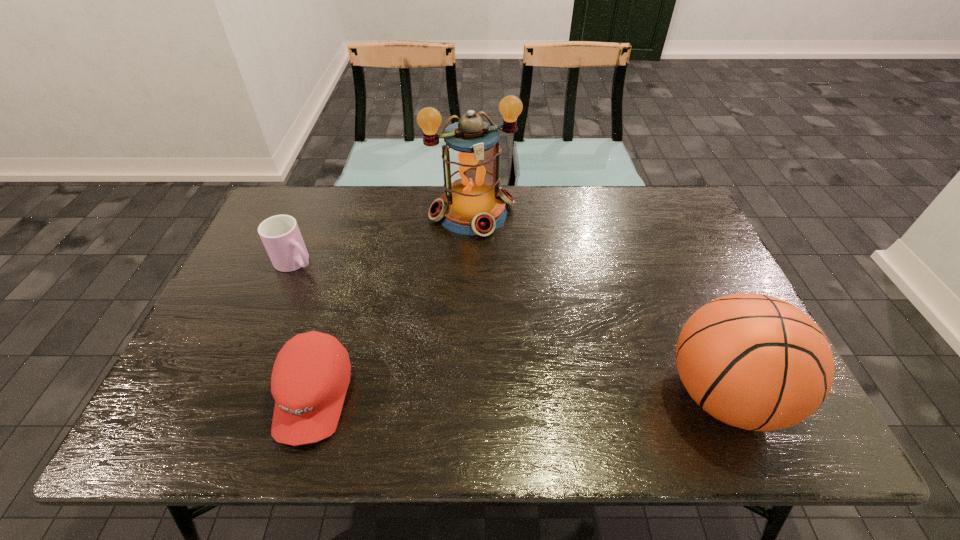
Find the location of a particular element. The image size is (960, 540). free space at the far edge of the desktop is located at coordinates (x=368, y=205).

This screenshot has width=960, height=540. I want to click on free space at the near edge of the desktop, so click(x=632, y=370).

The width and height of the screenshot is (960, 540). What are the coordinates of `vacant space at the left edge of the desktop` in the screenshot? It's located at (263, 259).

You are a GUI agent. You are given a task and a screenshot of the screen. Output one action in this format:
    pyautogui.click(x=<x>, y=<y>)
    Task: Click on the vacant space at the right edge
    
    Given the screenshot: What is the action you would take?
    pyautogui.click(x=704, y=241)

Locate an element on the screen. vacant space at the far left corner of the desktop is located at coordinates click(x=285, y=194).

What are the coordinates of `free area in between the farthest object and the rightmost object` in the screenshot? It's located at (598, 303).

The height and width of the screenshot is (540, 960). I want to click on vacant space that's between the rightmost object and the tallest object, so click(598, 303).

Where is `vacant region between the lantern and the second object from left to right`? The width and height of the screenshot is (960, 540). vacant region between the lantern and the second object from left to right is located at coordinates (394, 305).

Identify the location of unoccupied area between the third object from left to right and the cap. (x=394, y=305).

Where is `free space between the farthest object and the second tallest object`? free space between the farthest object and the second tallest object is located at coordinates (598, 303).